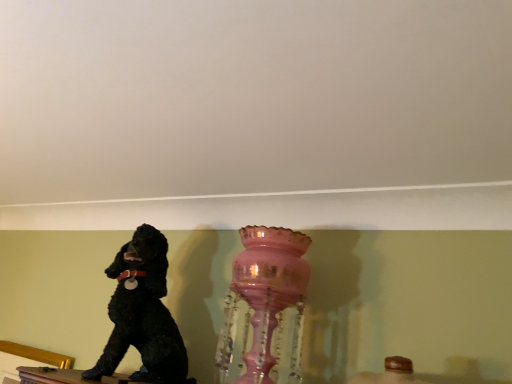
The width and height of the screenshot is (512, 384). Describe the element at coordinates (143, 314) in the screenshot. I see `black matte dog at left` at that location.

Identify the location of black matte dog at left. Image resolution: width=512 pixels, height=384 pixels. (143, 314).

Describe the element at coordinates (271, 298) in the screenshot. I see `pink glass vase at center` at that location.

Identify the location of pink glass vase at center. The width and height of the screenshot is (512, 384). (271, 298).

You are a GUI agent. You are given a task and a screenshot of the screen. Output one action in this format:
    pyautogui.click(x=<x>, y=<y>)
    Task: Click on the black matte dog at left
    
    Given the screenshot: What is the action you would take?
    pyautogui.click(x=143, y=314)

Considering the positions of objects pink glass vase at center and black matte dog at left in the image provided, who is more to the left, pink glass vase at center or black matte dog at left?

Answer: From the viewer's perspective, black matte dog at left appears more on the left side.

Does pink glass vase at center come behind black matte dog at left?

That is False.

Which is closer, (x=257, y=228) or (x=161, y=307)?

Positioned in front is point (x=257, y=228).

From the image's perspective, is pink glass vase at center beneath black matte dog at left?

No.

From a real-world perspective, is pink glass vase at center positioned under black matte dog at left based on gravity?

Incorrect, from a real-world perspective, pink glass vase at center is higher than black matte dog at left.

Considering the sizes of objects pink glass vase at center and black matte dog at left in the image provided, who is wider, pink glass vase at center or black matte dog at left?

black matte dog at left.

In terms of height, does pink glass vase at center look taller or shorter compared to black matte dog at left?

Clearly, pink glass vase at center is taller compared to black matte dog at left.

Considering the sizes of objects pink glass vase at center and black matte dog at left in the image provided, who is smaller, pink glass vase at center or black matte dog at left?

Smaller between the two is pink glass vase at center.

Is pink glass vase at center surrounding black matte dog at left?

No, black matte dog at left is located outside of pink glass vase at center.

In the scene shown: Are pink glass vase at center and black matte dog at left located far from each other?

No, pink glass vase at center is not far away from black matte dog at left.

Is pink glass vase at center positioned with its back to black matte dog at left?

No, pink glass vase at center is not facing the opposite direction of black matte dog at left.

What's the angular difference between pink glass vase at center and black matte dog at left's facing directions?

The angle between the facing direction of pink glass vase at center and the facing direction of black matte dog at left is 0.121 degrees.

Where is `dog that is below the pink glass vase at center (from the image's perspective)`? dog that is below the pink glass vase at center (from the image's perspective) is located at coordinates (143, 314).

Based on the photo, which is more to the left, black matte dog at left or pink glass vase at center?

From the viewer's perspective, black matte dog at left appears more on the left side.

Is black matte dog at left closer to camera compared to pink glass vase at center?

That is False.

Which point is more forward, (138, 305) or (278, 373)?

Point (278, 373)

Based on the photo, from the image's perspective, is black matte dog at left under pink glass vase at center?

Yes, from the image's perspective, black matte dog at left is beneath pink glass vase at center.

From a real-world perspective, which object stands above the other?

pink glass vase at center.

Considering the sizes of objects black matte dog at left and pink glass vase at center in the image provided, who is thinner, black matte dog at left or pink glass vase at center?

pink glass vase at center.

Is black matte dog at left taller than pink glass vase at center?

In fact, black matte dog at left may be shorter than pink glass vase at center.

Between black matte dog at left and pink glass vase at center, which one has smaller size?

Smaller between the two is pink glass vase at center.

Is pink glass vase at center completely or partially inside black matte dog at left?

That's incorrect, pink glass vase at center is not inside black matte dog at left.

Looking at this image, are black matte dog at left and pink glass vase at center making contact?

No, black matte dog at left is not next to pink glass vase at center.

Is black matte dog at left facing away from pink glass vase at center?

black matte dog at left is not turned away from pink glass vase at center.

Can you tell me how much black matte dog at left and pink glass vase at center differ in facing direction?

The angular difference between black matte dog at left and pink glass vase at center is 0.121 degrees.

You are a GUI agent. You are given a task and a screenshot of the screen. Output one action in this format:
    pyautogui.click(x=<x>, y=<y>)
    Task: Click on the dog below the pink glass vase at center (from the image's perspective)
    This screenshot has width=512, height=384.
    Given the screenshot: What is the action you would take?
    pyautogui.click(x=143, y=314)

You are a GUI agent. You are given a task and a screenshot of the screen. Output one action in this format:
    pyautogui.click(x=<x>, y=<y>)
    Task: Click on the dog behind the pink glass vase at center
    Image resolution: width=512 pixels, height=384 pixels.
    Given the screenshot: What is the action you would take?
    pyautogui.click(x=143, y=314)

Where is `dog to the left of pink glass vase at center`? This screenshot has width=512, height=384. dog to the left of pink glass vase at center is located at coordinates 143,314.